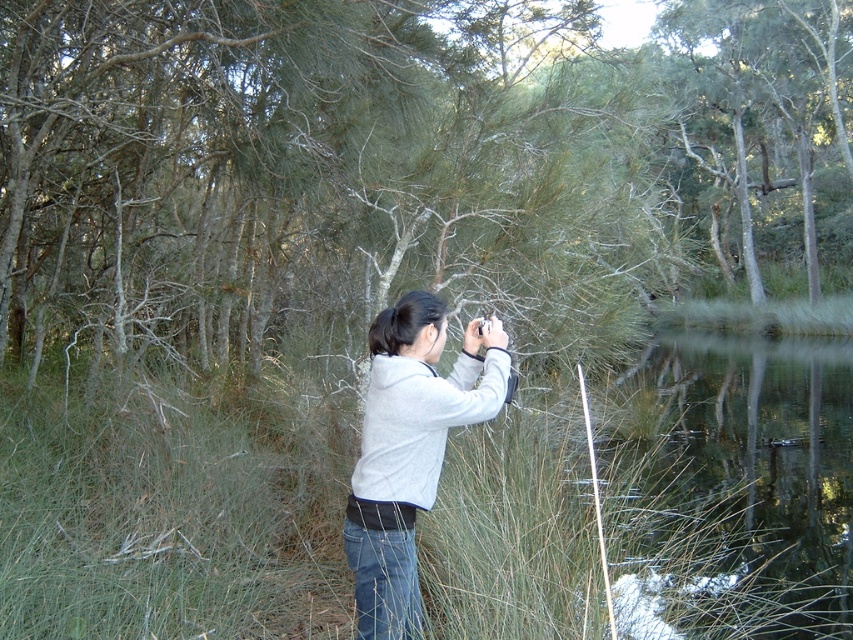
Based on the photo, who is lower down, clear water at lower right or gray fleece jacket at center?

clear water at lower right is lower down.

Does clear water at lower right have a smaller size compared to gray fleece jacket at center?

Actually, clear water at lower right might be larger than gray fleece jacket at center.

Where is `clear water at lower right`? The height and width of the screenshot is (640, 853). clear water at lower right is located at coordinates (728, 486).

I want to click on clear water at lower right, so click(x=728, y=486).

Can you confirm if green grass at center is positioned above clear water at lower right?

No, green grass at center is not above clear water at lower right.

Is point (683, 566) behind point (804, 596)?

No, it is not.

Describe the element at coordinates (165, 518) in the screenshot. I see `green grass at center` at that location.

Locate an element on the screen. This screenshot has height=640, width=853. green grass at center is located at coordinates pos(165,518).

Who is positioned more to the right, green grass at center or gray fleece jacket at center?

From the viewer's perspective, green grass at center appears more on the right side.

Based on the photo, does green grass at center have a lesser height compared to gray fleece jacket at center?

In fact, green grass at center may be taller than gray fleece jacket at center.

Is point (635, 596) positioned behind point (399, 326)?

Yes, point (635, 596) is behind point (399, 326).

The width and height of the screenshot is (853, 640). I want to click on green grass at center, so click(165, 518).